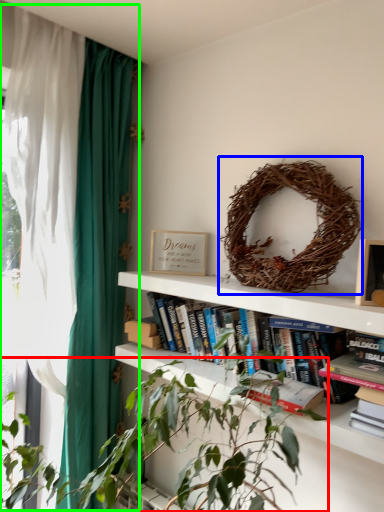
Question: Which object is the farthest from houseplant (highlighted by a red box)? Choose among these: bird nest (highlighted by a blue box) or curtain (highlighted by a green box).

Choices:
 (A) bird nest
 (B) curtain

Answer: (B)